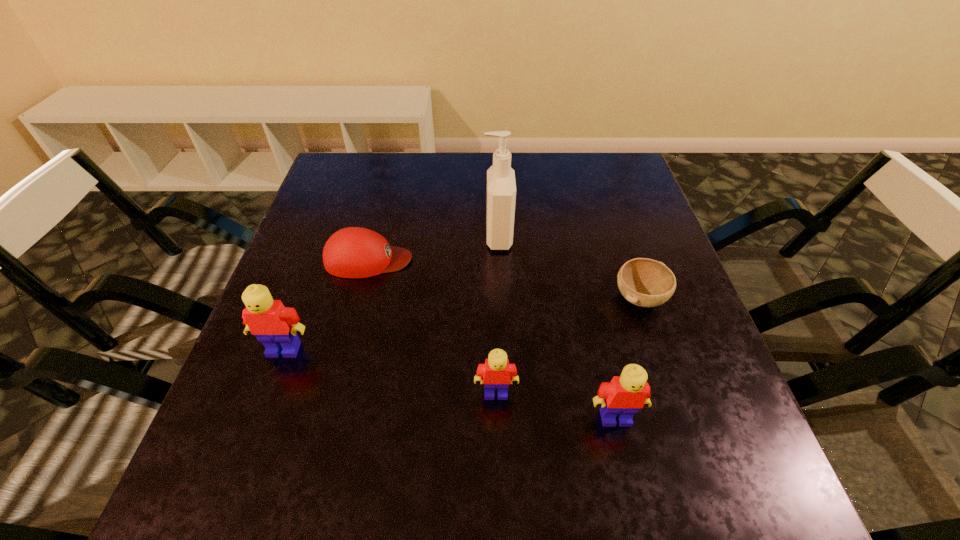
Where is `free space located 0.050m on the front-facing side of the farthest Lego`? The height and width of the screenshot is (540, 960). free space located 0.050m on the front-facing side of the farthest Lego is located at coordinates (273, 381).

Image resolution: width=960 pixels, height=540 pixels. In order to click on vacant region located on the front-facing side of the third shortest object in this screenshot , I will do `click(497, 439)`.

Identify the location of vacant position located 0.250m on the front label of the cleansing agent. This screenshot has width=960, height=540. (382, 237).

Where is `free space located 0.260m on the front label of the cleansing agent`? This screenshot has width=960, height=540. free space located 0.260m on the front label of the cleansing agent is located at coordinates (378, 237).

Locate an element on the screen. Image resolution: width=960 pixels, height=540 pixels. free space located 0.130m on the front label of the cleansing agent is located at coordinates (431, 237).

Locate an element on the screen. vacant space located on the front-facing side of the fifth tallest object is located at coordinates (532, 260).

The width and height of the screenshot is (960, 540). In order to click on free point located on the left of the shortest object in this screenshot , I will do `click(516, 298)`.

Locate an element on the screen. This screenshot has width=960, height=540. Lego that is at the left edge is located at coordinates (275, 325).

You are a GUI agent. You are given a task and a screenshot of the screen. Output one action in this format:
    pyautogui.click(x=<x>, y=<y>)
    Task: Click on the baseball cap that is at the left edge
    The image size is (960, 540).
    Given the screenshot: What is the action you would take?
    pyautogui.click(x=354, y=252)

Where is `object positioned at the right edge`? Image resolution: width=960 pixels, height=540 pixels. object positioned at the right edge is located at coordinates (644, 282).